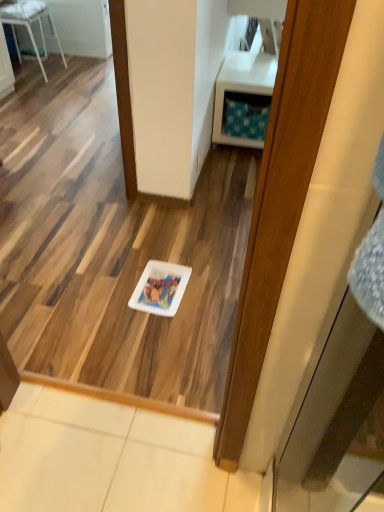
I want to click on free space to the back side of white glossy plate at center, so click(170, 253).